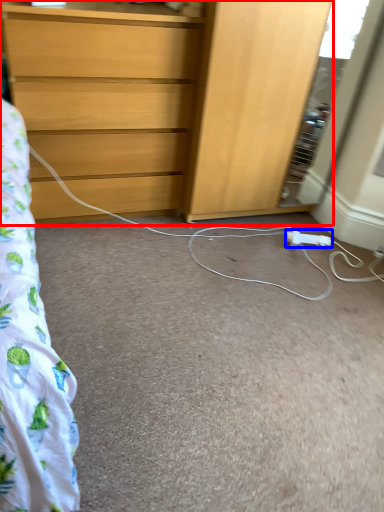
Question: Which of the following is the farthest to the observer, chest of drawers (highlighted by a red box) or extension cord (highlighted by a blue box)?

Choices:
 (A) chest of drawers
 (B) extension cord

Answer: (B)